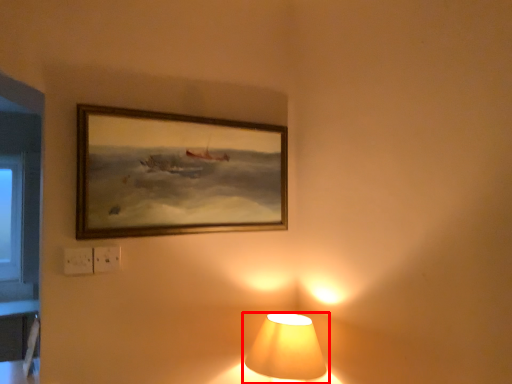
Question: In this image, where is lamp (annotated by the red box) located relative to picture frame?

Choices:
 (A) right
 (B) left

Answer: (A)